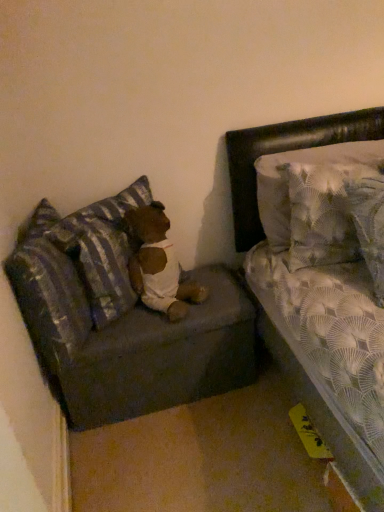
What are the coordinates of `brown plush teddy bear at center` in the screenshot? It's located at (158, 264).

Measure the distance between dark gray fabric couch at lower left and camera.

1.27 meters.

The image size is (384, 512). I want to click on striped fabric pillow at left, positioned as the first pillow in left-to-right order, so click(50, 298).

How much space does striped fabric pillow at left, which appears as the second pillow when viewed from the left, occupy vertically?

striped fabric pillow at left, which appears as the second pillow when viewed from the left, is 45.99 centimeters tall.

Identify the location of brown plush teddy bear at center. The image size is (384, 512). 158,264.

Can you confirm if dark gray fabric couch at lower left is thinner than striped fabric pillow at left, which appears as the 3th pillow when viewed from the right?

No.

Who is shorter, dark gray fabric couch at lower left or striped fabric pillow at left, which appears as the 3th pillow when viewed from the right?

dark gray fabric couch at lower left is shorter.

Where is `the 1st pillow above when counting from the dark gray fabric couch at lower left (from the image's perspective)`? the 1st pillow above when counting from the dark gray fabric couch at lower left (from the image's perspective) is located at coordinates (50, 298).

From the image's perspective, which one is positioned higher, patterned fabric pillow at upper right, which is counted as the first pillow, starting from the right, or dark gray fabric couch at lower left?

patterned fabric pillow at upper right, which is counted as the first pillow, starting from the right, appears higher in the image.

From a real-world perspective, is patterned fabric pillow at upper right, which is counted as the first pillow, starting from the right, positioned over dark gray fabric couch at lower left based on gravity?

Yes, from a real-world perspective, patterned fabric pillow at upper right, which is counted as the first pillow, starting from the right, is over dark gray fabric couch at lower left

Is patterned fabric pillow at upper right, which is counted as the third pillow, starting from the left, facing towards dark gray fabric couch at lower left?

No, patterned fabric pillow at upper right, which is counted as the third pillow, starting from the left, is not aimed at dark gray fabric couch at lower left.

Between patterned fabric pillow at upper right, which is counted as the third pillow, starting from the left, and dark gray fabric couch at lower left, which one appears on the right side from the viewer's perspective?

Positioned to the right is patterned fabric pillow at upper right, which is counted as the third pillow, starting from the left.

In terms of height, does patterned fabric pillow at upper right, which is counted as the first pillow, starting from the right, look taller or shorter compared to striped fabric pillow at left, which appears as the 3th pillow when viewed from the right?

patterned fabric pillow at upper right, which is counted as the first pillow, starting from the right, is taller than striped fabric pillow at left, which appears as the 3th pillow when viewed from the right.

Does patterned fabric pillow at upper right, which is counted as the first pillow, starting from the right, have a larger size compared to striped fabric pillow at left, which appears as the 3th pillow when viewed from the right?

Indeed, patterned fabric pillow at upper right, which is counted as the first pillow, starting from the right, has a larger size compared to striped fabric pillow at left, which appears as the 3th pillow when viewed from the right.

Does point (284, 208) come farther from viewer compared to point (70, 307)?

Yes, it is.

Is patterned fabric pillow at upper right, which is counted as the first pillow, starting from the right, at the left side of striped fabric pillow at left, positioned as the first pillow in left-to-right order?

No, patterned fabric pillow at upper right, which is counted as the first pillow, starting from the right, is not to the left of striped fabric pillow at left, positioned as the first pillow in left-to-right order.

Relative to striped fabric pillow at left, which appears as the second pillow when viewed from the left, is striped fabric pillow at left, positioned as the first pillow in left-to-right order, in front or behind?

striped fabric pillow at left, positioned as the first pillow in left-to-right order, is positioned closer to the viewer than striped fabric pillow at left, which appears as the second pillow when viewed from the left.

Consider the image. Could you measure the distance between striped fabric pillow at left, positioned as the first pillow in left-to-right order, and striped fabric pillow at left, which appears as the second pillow when viewed from the right?

A distance of 5.83 inches exists between striped fabric pillow at left, positioned as the first pillow in left-to-right order, and striped fabric pillow at left, which appears as the second pillow when viewed from the right.

Does striped fabric pillow at left, positioned as the first pillow in left-to-right order, touch striped fabric pillow at left, which appears as the second pillow when viewed from the right?

No, striped fabric pillow at left, positioned as the first pillow in left-to-right order, is not touching striped fabric pillow at left, which appears as the second pillow when viewed from the right.

From the image's perspective, is striped fabric pillow at left, which appears as the 3th pillow when viewed from the right, above striped fabric pillow at left, which appears as the second pillow when viewed from the right?

No, from the image's perspective, striped fabric pillow at left, which appears as the 3th pillow when viewed from the right, is not over striped fabric pillow at left, which appears as the second pillow when viewed from the right.

Which of these two, striped fabric pillow at left, positioned as the first pillow in left-to-right order, or patterned fabric pillow at upper right, which is counted as the third pillow, starting from the left, stands taller?

Standing taller between the two is patterned fabric pillow at upper right, which is counted as the third pillow, starting from the left.

From a real-world perspective, starting from the striped fabric pillow at left, which appears as the 3th pillow when viewed from the right, which pillow is the 2nd one vertically above it? Please provide its 2D coordinates.

[(286, 187)]

From the image's perspective, which one is positioned lower, striped fabric pillow at left, which appears as the 3th pillow when viewed from the right, or patterned fabric pillow at upper right, which is counted as the first pillow, starting from the right?

From the image's view, striped fabric pillow at left, which appears as the 3th pillow when viewed from the right, is below.

Is point (81, 311) positioned before point (273, 233)?

That is True.

Measure the distance between patterned fabric pillow at upper right, which is counted as the first pillow, starting from the right, and striped fabric pillow at left, which appears as the second pillow when viewed from the right.

patterned fabric pillow at upper right, which is counted as the first pillow, starting from the right, and striped fabric pillow at left, which appears as the second pillow when viewed from the right, are 23.93 inches apart.

Is patterned fabric pillow at upper right, which is counted as the third pillow, starting from the left, positioned beyond the bounds of striped fabric pillow at left, which appears as the second pillow when viewed from the left?

patterned fabric pillow at upper right, which is counted as the third pillow, starting from the left, is positioned outside striped fabric pillow at left, which appears as the second pillow when viewed from the left.

From their relative heights in the image, would you say patterned fabric pillow at upper right, which is counted as the first pillow, starting from the right, is taller or shorter than striped fabric pillow at left, which appears as the second pillow when viewed from the left?

Clearly, patterned fabric pillow at upper right, which is counted as the first pillow, starting from the right, is taller compared to striped fabric pillow at left, which appears as the second pillow when viewed from the left.

This screenshot has width=384, height=512. In order to click on pillow below the brown plush teddy bear at center (from the image's perspective) in this screenshot , I will do [50, 298].

From the image's perspective, which is above, brown plush teddy bear at center or striped fabric pillow at left, which appears as the 3th pillow when viewed from the right?

brown plush teddy bear at center appears higher in the image.

Considering the sizes of objects brown plush teddy bear at center and striped fabric pillow at left, positioned as the first pillow in left-to-right order, in the image provided, who is bigger, brown plush teddy bear at center or striped fabric pillow at left, positioned as the first pillow in left-to-right order,?

striped fabric pillow at left, positioned as the first pillow in left-to-right order, is bigger.

Is brown plush teddy bear at center inside the boundaries of striped fabric pillow at left, positioned as the first pillow in left-to-right order, or outside?

brown plush teddy bear at center is outside striped fabric pillow at left, positioned as the first pillow in left-to-right order.

Locate an element on the screen. Image resolution: width=384 pixels, height=512 pixels. the 1st pillow above the dark gray fabric couch at lower left (from the image's perspective) is located at coordinates (50, 298).

Find the location of a particular element. This screenshot has width=384, height=512. studio couch lying on the left of patterned fabric pillow at upper right, which is counted as the third pillow, starting from the left is located at coordinates (121, 320).

Looking at the image, which one is located further to striped fabric pillow at left, which appears as the second pillow when viewed from the left, brown plush teddy bear at center or striped fabric pillow at left, which appears as the 3th pillow when viewed from the right?

striped fabric pillow at left, which appears as the 3th pillow when viewed from the right, is positioned further to the anchor striped fabric pillow at left, which appears as the second pillow when viewed from the left.

From the image, which object appears to be farther from dark gray fabric couch at lower left, striped fabric pillow at left, positioned as the first pillow in left-to-right order, or striped fabric pillow at left, which appears as the second pillow when viewed from the left?

Based on the image, striped fabric pillow at left, positioned as the first pillow in left-to-right order, appears to be further to dark gray fabric couch at lower left.

Based on their spatial positions, is brown plush teddy bear at center or dark gray fabric couch at lower left closer to patterned fabric pillow at upper right, which is counted as the first pillow, starting from the right?

Among the two, brown plush teddy bear at center is located nearer to patterned fabric pillow at upper right, which is counted as the first pillow, starting from the right.

Which object lies nearer to the anchor point dark gray fabric couch at lower left, brown plush teddy bear at center or striped fabric pillow at left, which appears as the 3th pillow when viewed from the right?

striped fabric pillow at left, which appears as the 3th pillow when viewed from the right.

Estimate the real-world distances between objects in this image. Which object is further from brown plush teddy bear at center, striped fabric pillow at left, which appears as the second pillow when viewed from the right, or striped fabric pillow at left, which appears as the 3th pillow when viewed from the right?

Based on the image, striped fabric pillow at left, which appears as the 3th pillow when viewed from the right, appears to be further to brown plush teddy bear at center.

When comparing their distances from brown plush teddy bear at center, does striped fabric pillow at left, which appears as the second pillow when viewed from the right, or patterned fabric pillow at upper right, which is counted as the first pillow, starting from the right, seem further?

patterned fabric pillow at upper right, which is counted as the first pillow, starting from the right, lies further to brown plush teddy bear at center than the other object.

Based on their spatial positions, is striped fabric pillow at left, which appears as the 3th pillow when viewed from the right, or brown plush teddy bear at center further from patterned fabric pillow at upper right, which is counted as the first pillow, starting from the right?

striped fabric pillow at left, which appears as the 3th pillow when viewed from the right.

Based on their spatial positions, is striped fabric pillow at left, which appears as the second pillow when viewed from the right, or brown plush teddy bear at center closer to striped fabric pillow at left, positioned as the first pillow in left-to-right order?

striped fabric pillow at left, which appears as the second pillow when viewed from the right.

The height and width of the screenshot is (512, 384). Identify the location of teddy between striped fabric pillow at left, which appears as the 3th pillow when viewed from the right, and patterned fabric pillow at upper right, which is counted as the first pillow, starting from the right, from left to right. (158, 264).

Identify the location of teddy between dark gray fabric couch at lower left and patterned fabric pillow at upper right, which is counted as the first pillow, starting from the right, in the horizontal direction. (158, 264).

Where is `studio couch between striped fabric pillow at left, which appears as the 3th pillow when viewed from the right, and patterned fabric pillow at upper right, which is counted as the third pillow, starting from the left, from left to right`? This screenshot has width=384, height=512. studio couch between striped fabric pillow at left, which appears as the 3th pillow when viewed from the right, and patterned fabric pillow at upper right, which is counted as the third pillow, starting from the left, from left to right is located at coordinates (121, 320).

You are a GUI agent. You are given a task and a screenshot of the screen. Output one action in this format:
    pyautogui.click(x=<x>, y=<y>)
    Task: Click on the pillow between striped fabric pillow at left, which appears as the second pillow when viewed from the left, and dark gray fabric couch at lower left, in the vertical direction
    The height and width of the screenshot is (512, 384).
    Given the screenshot: What is the action you would take?
    pyautogui.click(x=50, y=298)